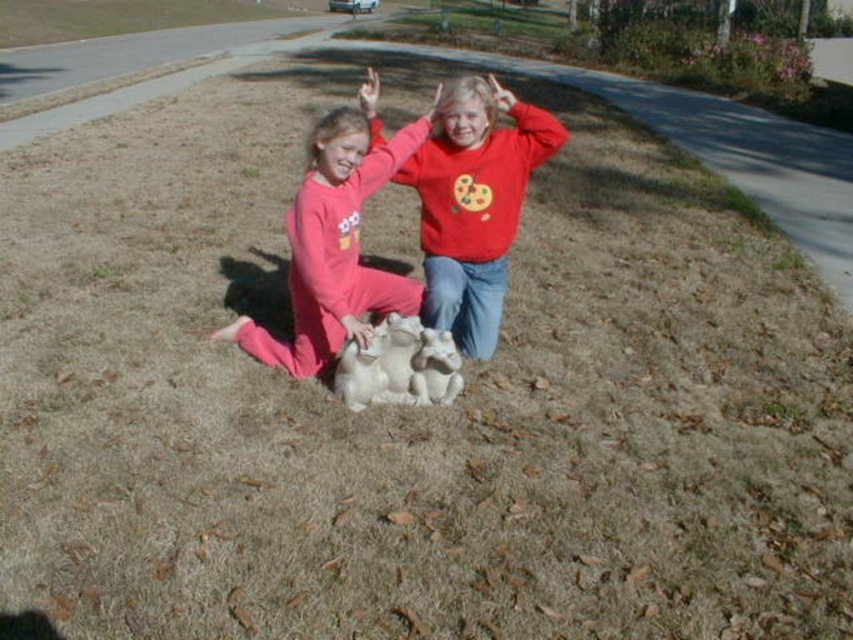
Which is below, pink fleece pants at center or white fur dog at center?

Positioned lower is white fur dog at center.

This screenshot has height=640, width=853. Find the location of `pink fleece pants at center`. pink fleece pants at center is located at coordinates (334, 248).

Is matte red sweatshirt at center thinner than pink fleece pants at center?

Yes, matte red sweatshirt at center is thinner than pink fleece pants at center.

Image resolution: width=853 pixels, height=640 pixels. Describe the element at coordinates (474, 202) in the screenshot. I see `matte red sweatshirt at center` at that location.

Is point (463, 332) closer to camera compared to point (335, 154)?

No, (463, 332) is behind (335, 154).

Find the location of a particular element. matte red sweatshirt at center is located at coordinates (474, 202).

Can you confirm if matte red sweatshirt at center is positioned below white fur dog at center?

Incorrect, matte red sweatshirt at center is not positioned below white fur dog at center.

Does matte red sweatshirt at center come behind white fur dog at center?

Yes, it is behind white fur dog at center.

Between point (531, 128) and point (405, 403), which one is positioned behind?

The point (531, 128) is more distant.

The height and width of the screenshot is (640, 853). What are the coordinates of `matte red sweatshirt at center` in the screenshot? It's located at (474, 202).